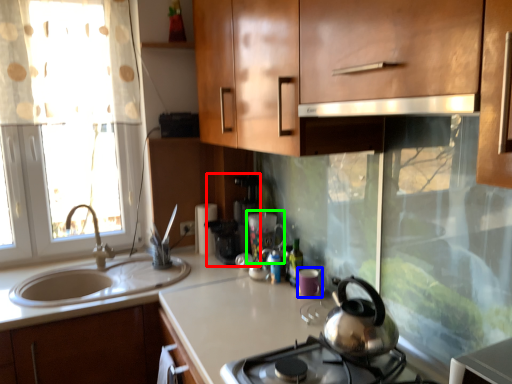
Question: Considering the real-world distances, which object is closest to coffee machine (highlighted by a red box)? appliance (highlighted by a blue box) or appliance (highlighted by a green box).

Choices:
 (A) appliance
 (B) appliance

Answer: (B)